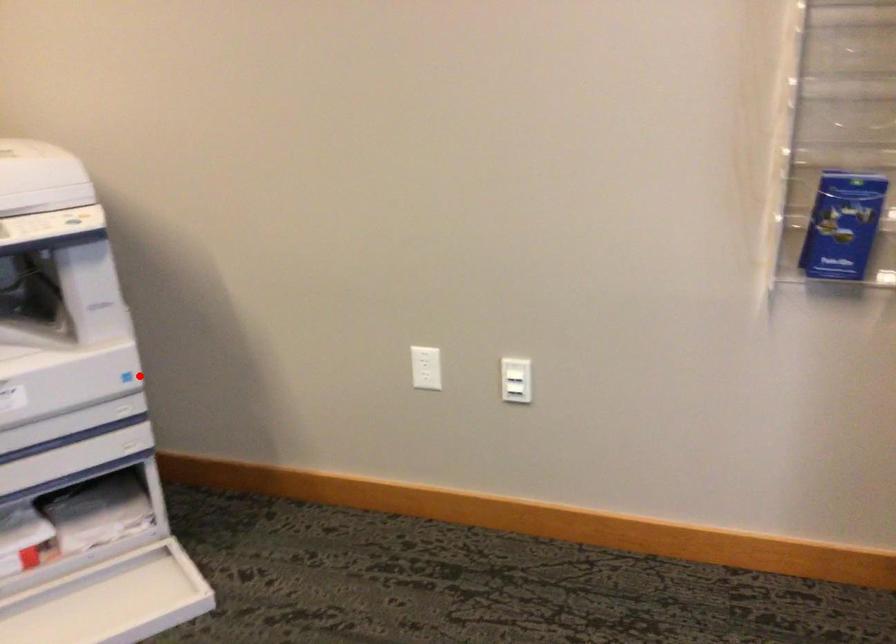
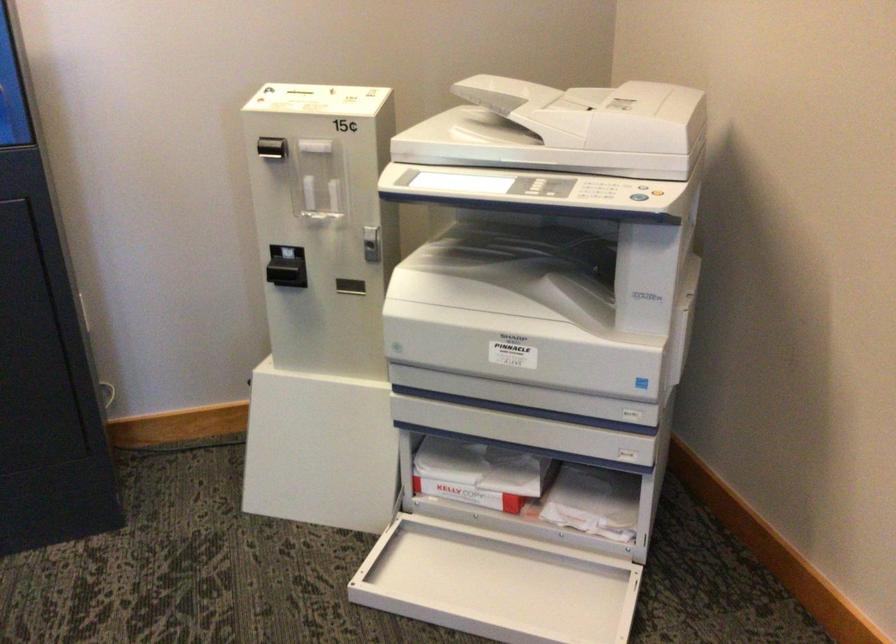
In the second image, find the point that corresponds to the highlighted location in the first image.

(643, 384)